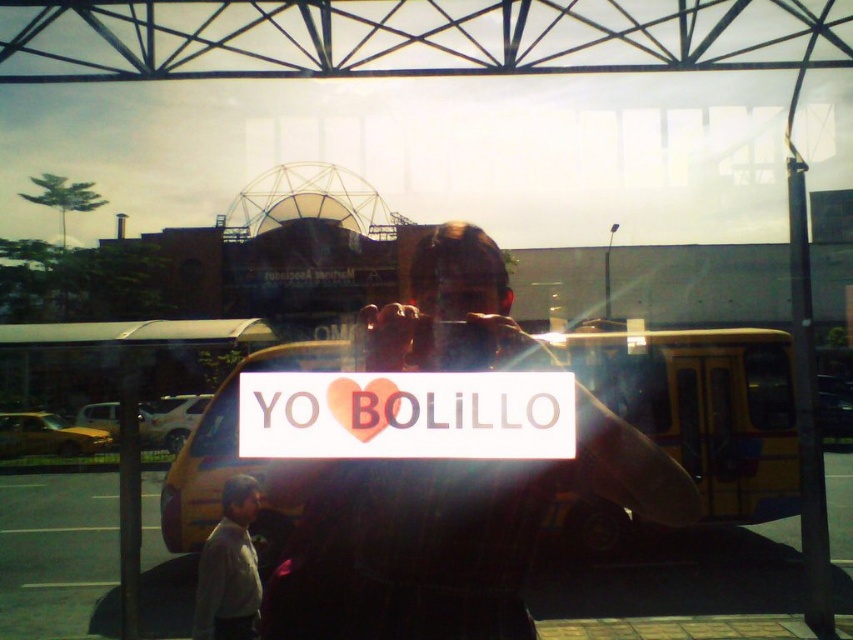
Image resolution: width=853 pixels, height=640 pixels. Describe the element at coordinates (448, 536) in the screenshot. I see `matte black sign at center` at that location.

Can you confirm if matte black sign at center is positioned to the left of white matte sign at center?

No, matte black sign at center is not to the left of white matte sign at center.

Who is more distant from viewer, (477, 248) or (508, 435)?

Point (477, 248)

This screenshot has width=853, height=640. I want to click on matte black sign at center, so click(448, 536).

Measure the distance between white matte sign at center and gray fabric shirt at lower left.

white matte sign at center is 2.69 meters away from gray fabric shirt at lower left.

Can you confirm if white matte sign at center is positioned to the right of gray fabric shirt at lower left?

Yes, white matte sign at center is to the right of gray fabric shirt at lower left.

The image size is (853, 640). I want to click on white matte sign at center, so click(x=405, y=416).

Find the location of a particular element. This screenshot has width=853, height=640. white matte sign at center is located at coordinates (405, 416).

Can you confirm if matte black sign at center is shorter than gray fabric shirt at lower left?

Incorrect, matte black sign at center's height does not fall short of gray fabric shirt at lower left's.

Which is behind, point (465, 595) or point (253, 548)?

The point (253, 548) is behind.

Image resolution: width=853 pixels, height=640 pixels. Identify the location of matte black sign at center. (448, 536).